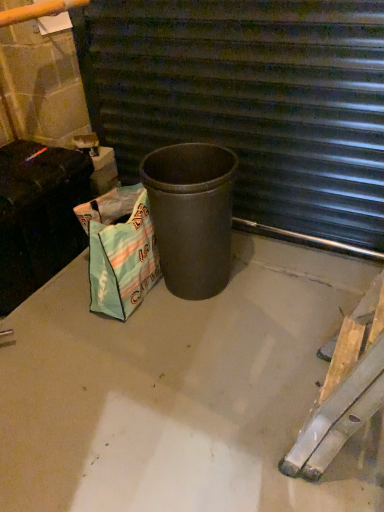
I want to click on free space in front of matte black trash can at center, so click(207, 334).